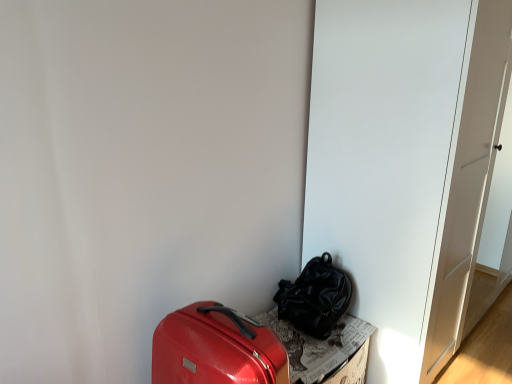
Image resolution: width=512 pixels, height=384 pixels. What do you see at coordinates (383, 159) in the screenshot? I see `white matte door at center` at bounding box center [383, 159].

How much space does shiny black backpack at center, which is counted as the second luggage and bags, starting from the front, occupy vertically?

The height of shiny black backpack at center, which is counted as the second luggage and bags, starting from the front, is 13.17 inches.

Locate an element on the screen. This screenshot has width=512, height=384. shiny black backpack at center, which is counted as the second luggage and bags, starting from the front is located at coordinates (315, 297).

Image resolution: width=512 pixels, height=384 pixels. Identify the location of white matte door at center. (383, 159).

Is white matte door at center to the left of shiny red suitcase at lower left, placed as the second luggage and bags when sorted from right to left, from the viewer's perspective?

Incorrect, white matte door at center is not on the left side of shiny red suitcase at lower left, placed as the second luggage and bags when sorted from right to left.

From a real-world perspective, is white matte door at center under shiny red suitcase at lower left, the first luggage and bags when ordered from left to right?

Actually, white matte door at center is physically above shiny red suitcase at lower left, the first luggage and bags when ordered from left to right, in the real world.

Is white matte door at center located outside shiny red suitcase at lower left, the first luggage and bags when ordered from left to right?

That's correct, white matte door at center is outside of shiny red suitcase at lower left, the first luggage and bags when ordered from left to right.

Can shiny red suitcase at lower left, placed as the second luggage and bags when sorted from right to left, be found inside cardboard textured box at lower right?

Result: No, shiny red suitcase at lower left, placed as the second luggage and bags when sorted from right to left, is located outside of cardboard textured box at lower right.

From their relative heights in the image, would you say cardboard textured box at lower right is taller or shorter than shiny red suitcase at lower left, the first luggage and bags positioned from the front?

Clearly, cardboard textured box at lower right is shorter compared to shiny red suitcase at lower left, the first luggage and bags positioned from the front.

Considering the sizes of cardboard textured box at lower right and shiny red suitcase at lower left, the first luggage and bags positioned from the front, in the image, is cardboard textured box at lower right bigger or smaller than shiny red suitcase at lower left, the first luggage and bags positioned from the front,?

Considering their sizes, cardboard textured box at lower right takes up more space than shiny red suitcase at lower left, the first luggage and bags positioned from the front.

Is shiny red suitcase at lower left, arranged as the second luggage and bags when viewed from the back, directly adjacent to shiny black backpack at center, which is counted as the second luggage and bags, starting from the front?

No, shiny red suitcase at lower left, arranged as the second luggage and bags when viewed from the back, is not in contact with shiny black backpack at center, which is counted as the second luggage and bags, starting from the front.

From the image's perspective, is shiny red suitcase at lower left, arranged as the second luggage and bags when viewed from the back, above or below shiny black backpack at center, which is counted as the second luggage and bags, starting from the front?

Clearly, from the image's perspective, shiny red suitcase at lower left, arranged as the second luggage and bags when viewed from the back, is below shiny black backpack at center, which is counted as the second luggage and bags, starting from the front.

From a real-world perspective, between shiny red suitcase at lower left, placed as the second luggage and bags when sorted from right to left, and shiny black backpack at center, acting as the second luggage and bags starting from the left, who is vertically higher?

From a 3D spatial view, shiny black backpack at center, acting as the second luggage and bags starting from the left, is above.

Considering the positions of objects shiny red suitcase at lower left, arranged as the second luggage and bags when viewed from the back, and shiny black backpack at center, the 1th luggage and bags when ordered from back to front, in the image provided, who is more to the right, shiny red suitcase at lower left, arranged as the second luggage and bags when viewed from the back, or shiny black backpack at center, the 1th luggage and bags when ordered from back to front,?

Positioned to the right is shiny black backpack at center, the 1th luggage and bags when ordered from back to front.

Can you confirm if shiny red suitcase at lower left, the first luggage and bags positioned from the front, is positioned to the left of cardboard textured box at lower right?

Indeed, shiny red suitcase at lower left, the first luggage and bags positioned from the front, is positioned on the left side of cardboard textured box at lower right.

From a real-world perspective, which is physically below, shiny red suitcase at lower left, placed as the second luggage and bags when sorted from right to left, or cardboard textured box at lower right?

From a 3D spatial view, cardboard textured box at lower right is below.

Is shiny red suitcase at lower left, the first luggage and bags positioned from the front, looking in the opposite direction of cardboard textured box at lower right?

No, shiny red suitcase at lower left, the first luggage and bags positioned from the front,'s orientation is not away from cardboard textured box at lower right.

Is shiny red suitcase at lower left, the first luggage and bags positioned from the front, wider or thinner than cardboard textured box at lower right?

Answer: shiny red suitcase at lower left, the first luggage and bags positioned from the front, is wider than cardboard textured box at lower right.

Which point is more forward, (x=323, y=268) or (x=263, y=350)?

The point (x=263, y=350) is closer to the camera.

Is shiny black backpack at center, which is counted as the second luggage and bags, starting from the front, turned away from shiny red suitcase at lower left, the first luggage and bags when ordered from left to right?

No, shiny red suitcase at lower left, the first luggage and bags when ordered from left to right, is not at the back of shiny black backpack at center, which is counted as the second luggage and bags, starting from the front.

Looking at this image, is white matte door at center facing away from shiny black backpack at center, acting as the second luggage and bags starting from the left?

No, white matte door at center's orientation is not away from shiny black backpack at center, acting as the second luggage and bags starting from the left.

Does point (352, 305) come closer to viewer compared to point (295, 304)?

No, it is behind (295, 304).

Considering their positions, is white matte door at center located in front of or behind shiny black backpack at center, the 1th luggage and bags when ordered from back to front?

Clearly, white matte door at center is in front of shiny black backpack at center, the 1th luggage and bags when ordered from back to front.

From the image's perspective, is white matte door at center under shiny black backpack at center, the first luggage and bags from the right?

No, from the image's perspective, white matte door at center is not beneath shiny black backpack at center, the first luggage and bags from the right.

Which object is positioned more to the left, cardboard textured box at lower right or shiny black backpack at center, the first luggage and bags from the right?

From the viewer's perspective, cardboard textured box at lower right appears more on the left side.

Is cardboard textured box at lower right closer to camera compared to shiny black backpack at center, the 1th luggage and bags when ordered from back to front?

Yes, cardboard textured box at lower right is in front of shiny black backpack at center, the 1th luggage and bags when ordered from back to front.

From the image's perspective, is cardboard textured box at lower right on shiny black backpack at center, the 1th luggage and bags when ordered from back to front?

Incorrect, from the image's perspective, cardboard textured box at lower right is lower than shiny black backpack at center, the 1th luggage and bags when ordered from back to front.

Considering the sizes of cardboard textured box at lower right and shiny black backpack at center, the first luggage and bags from the right, in the image, is cardboard textured box at lower right wider or thinner than shiny black backpack at center, the first luggage and bags from the right,?

Clearly, cardboard textured box at lower right has more width compared to shiny black backpack at center, the first luggage and bags from the right.

Where is `door located above the shiny red suitcase at lower left, the first luggage and bags positioned from the front (from the image's perspective)`? This screenshot has width=512, height=384. door located above the shiny red suitcase at lower left, the first luggage and bags positioned from the front (from the image's perspective) is located at coordinates (383, 159).

This screenshot has width=512, height=384. Find the location of `luggage and bags that appears on the left of cardboard textured box at lower right`. luggage and bags that appears on the left of cardboard textured box at lower right is located at coordinates (216, 348).

From the picture: Based on their spatial positions, is white matte door at center or shiny red suitcase at lower left, arranged as the second luggage and bags when viewed from the back, further from cardboard textured box at lower right?

white matte door at center is further to cardboard textured box at lower right.

Which object lies nearer to the anchor point shiny black backpack at center, the first luggage and bags from the right, shiny red suitcase at lower left, placed as the second luggage and bags when sorted from right to left, or cardboard textured box at lower right?

Among the two, cardboard textured box at lower right is located nearer to shiny black backpack at center, the first luggage and bags from the right.

When comparing their distances from cardboard textured box at lower right, does white matte door at center or shiny black backpack at center, the 1th luggage and bags when ordered from back to front, seem further?

white matte door at center is positioned further to the anchor cardboard textured box at lower right.

Looking at the image, which one is located closer to shiny red suitcase at lower left, arranged as the second luggage and bags when viewed from the back, shiny black backpack at center, the first luggage and bags from the right, or white matte door at center?

shiny black backpack at center, the first luggage and bags from the right, is closer to shiny red suitcase at lower left, arranged as the second luggage and bags when viewed from the back.

Based on their spatial positions, is shiny black backpack at center, the first luggage and bags from the right, or shiny red suitcase at lower left, the first luggage and bags when ordered from left to right, further from cardboard textured box at lower right?

Among the two, shiny red suitcase at lower left, the first luggage and bags when ordered from left to right, is located further to cardboard textured box at lower right.

Which object lies further to the anchor point shiny red suitcase at lower left, the first luggage and bags when ordered from left to right, cardboard textured box at lower right or white matte door at center?

Among the two, white matte door at center is located further to shiny red suitcase at lower left, the first luggage and bags when ordered from left to right.

Based on their spatial positions, is shiny black backpack at center, the first luggage and bags from the right, or cardboard textured box at lower right further from shiny red suitcase at lower left, the first luggage and bags when ordered from left to right?

shiny black backpack at center, the first luggage and bags from the right, is positioned further to the anchor shiny red suitcase at lower left, the first luggage and bags when ordered from left to right.

Estimate the real-world distances between objects in this image. Which object is closer to white matte door at center, cardboard textured box at lower right or shiny black backpack at center, the 1th luggage and bags when ordered from back to front?

shiny black backpack at center, the 1th luggage and bags when ordered from back to front, is closer to white matte door at center.

Where is `cardboard box situated between shiny red suitcase at lower left, the first luggage and bags when ordered from left to right, and white matte door at center from left to right`? The image size is (512, 384). cardboard box situated between shiny red suitcase at lower left, the first luggage and bags when ordered from left to right, and white matte door at center from left to right is located at coordinates (318, 346).

Where is `luggage and bags situated between shiny red suitcase at lower left, the first luggage and bags positioned from the front, and white matte door at center from left to right`? The width and height of the screenshot is (512, 384). luggage and bags situated between shiny red suitcase at lower left, the first luggage and bags positioned from the front, and white matte door at center from left to right is located at coordinates (315, 297).

I want to click on cardboard box positioned between shiny red suitcase at lower left, the first luggage and bags when ordered from left to right, and shiny black backpack at center, acting as the second luggage and bags starting from the left, from near to far, so click(x=318, y=346).